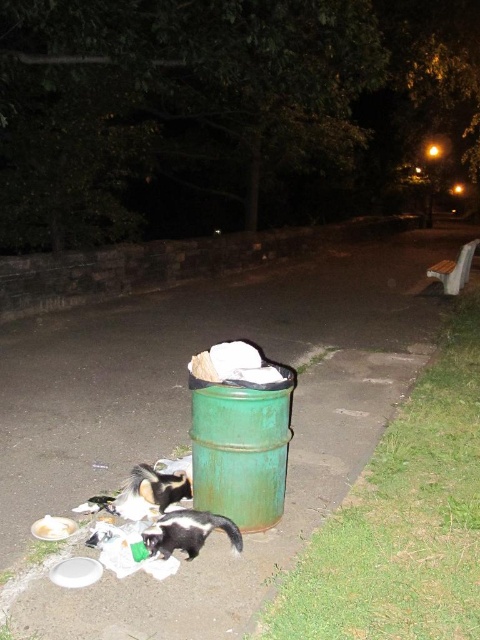
Between point (50, 369) and point (197, 544), which one is positioned in front?

Point (197, 544) is in front.

Who is more distant from viewer, (x=381, y=428) or (x=187, y=554)?

Point (x=381, y=428)

Locate an element on the screen. This screenshot has width=480, height=640. green metallic trash can at lower center is located at coordinates (189, 417).